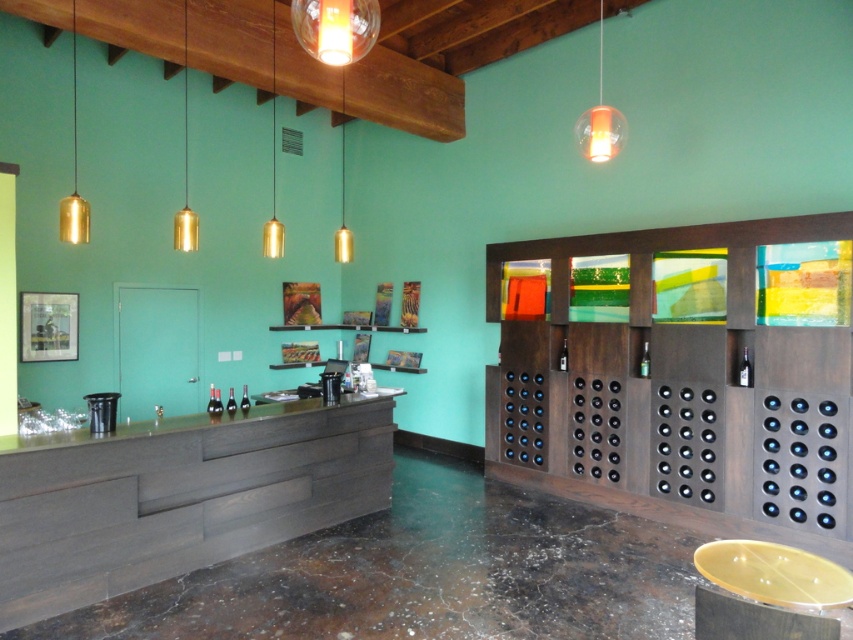
You are a customer in the wine tasting room and want to place your wine glass on the dark wood counter at center. However, you notice there is a smooth wood counter at center above it. Which counter should you choose to place your glass to avoid it slipping?

You should place your glass on the smooth wood counter at center because it is located above the dark wood counter at center and its smooth surface may provide a better grip to prevent slipping.

You are a customer entering the wine tasting room and want to place your order. Where is the dark wood counter at center located relative to the entrance?

The dark wood counter at center is located at point 0.777 on the x axis and 0.210 on the y axis relative to the entrance.

You are a visitor in the wine tasting room and want to place your coat on the dark wood counter at center. However, you notice another object already occupying part of the counter. Which object is blocking your space?

The trash bin and a small framed picture are occupying part of the dark wood counter at center.